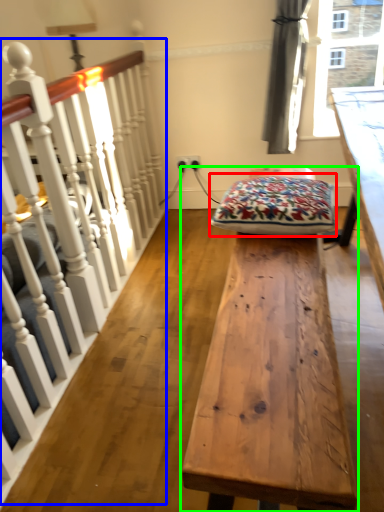
Question: Which object is positioned farthest from blanket (highlighted by a red box)? Select from rail (highlighted by a blue box) and table (highlighted by a green box).

Choices:
 (A) rail
 (B) table

Answer: (A)